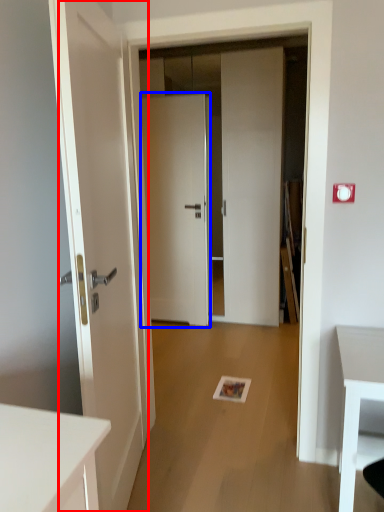
Question: Among these objects, which one is nearest to the camera, door (highlighted by a red box) or door (highlighted by a blue box)?

Choices:
 (A) door
 (B) door

Answer: (A)